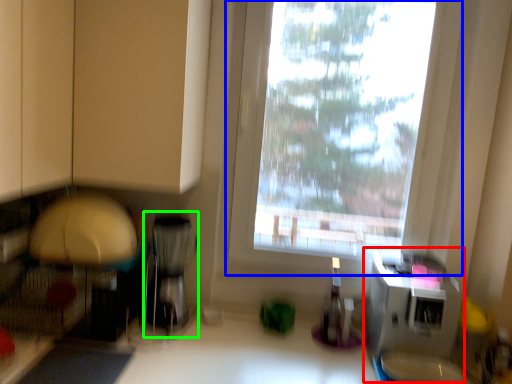
Question: Which object is the farthest from appliance (highlighted by a red box)? Choose among these: window (highlighted by a blue box) or appliance (highlighted by a green box).

Choices:
 (A) window
 (B) appliance

Answer: (B)